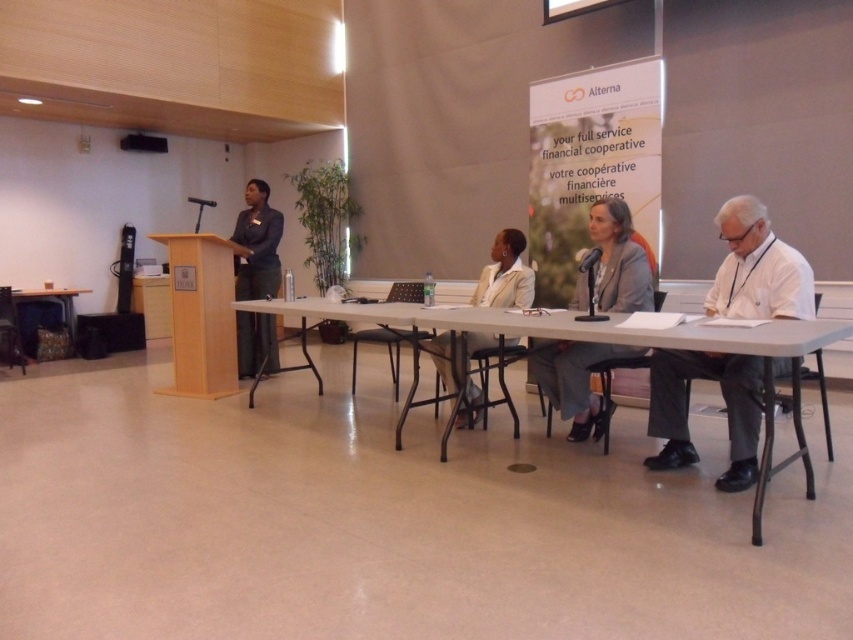
You are attending a formal event and need to place a name tag on the table. The name tag must be placed at the exact coordinates of the white paper at right. Where should you place the name tag on the table?

The white paper at right is located at the coordinates point (686, 410), so you should place the name tag at that exact point on the table.

You are attending a formal conference and notice a white paper at right on the table. If you want to place a notebook exactly where the white paper is, what coordinates should you aim for?

The white paper at right is located at point (686, 410), so you should aim for those coordinates to place the notebook there.

You are attending a conference and need to present a document. The white paper at right is represented by point (686, 410). Where should you place your presentation materials relative to the white paper at right to ensure they are visible to everyone?

Place your presentation materials to the left of the white paper at right since the white paper at right is located on the right side of the scene.